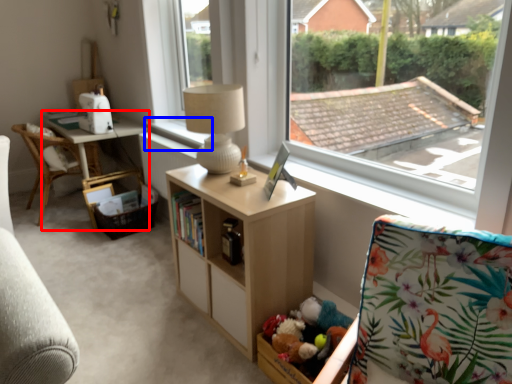
Question: Which of the following is the farthest to the observer, table (highlighted by a red box) or window sill (highlighted by a blue box)?

Choices:
 (A) table
 (B) window sill

Answer: (A)